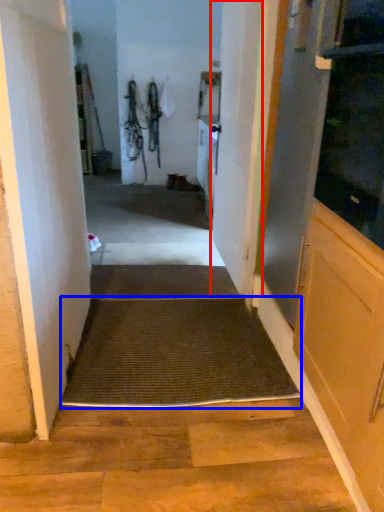
Question: Which point is further to the camera, door (highlighted by a red box) or doormat (highlighted by a blue box)?

Choices:
 (A) door
 (B) doormat

Answer: (A)